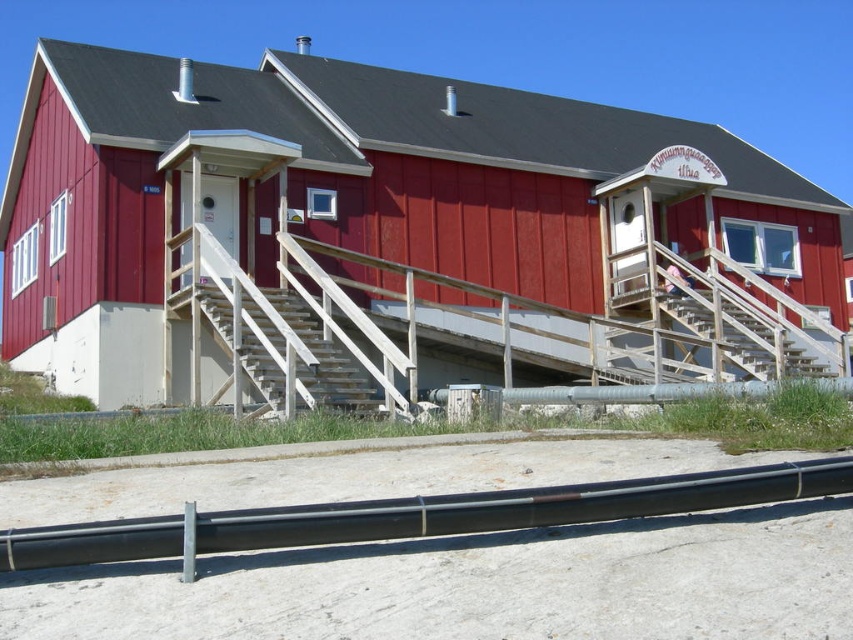
Question: Among these objects, which one is nearest to the camera?

Choices:
 (A) smooth red wooden hut at center
 (B) wooden stairs at center

Answer: (A)

Question: Among these points, which one is farthest from the camera?

Choices:
 (A) (675, 292)
 (B) (282, 547)
 (C) (302, 355)

Answer: (A)

Question: From the image, what is the correct spatial relationship of black metal rail at lower center in relation to wooden stairs at center?

Choices:
 (A) above
 (B) below

Answer: (B)

Question: Observing the image, what is the correct spatial positioning of smooth red wooden hut at center in reference to wooden stairs at center?

Choices:
 (A) above
 (B) below

Answer: (A)

Question: Is black metal rail at lower center in front of wooden stairs at lower right?

Choices:
 (A) yes
 (B) no

Answer: (A)

Question: Which object is farther from the camera taking this photo?

Choices:
 (A) black metal rail at lower center
 (B) smooth red wooden hut at center
 (C) wooden stairs at center
 (D) wooden stairs at lower right

Answer: (D)